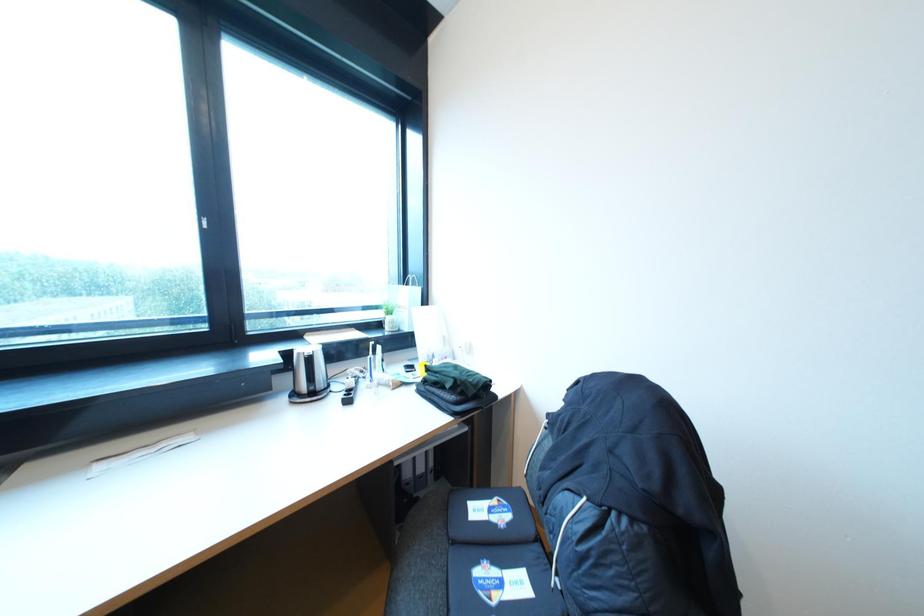
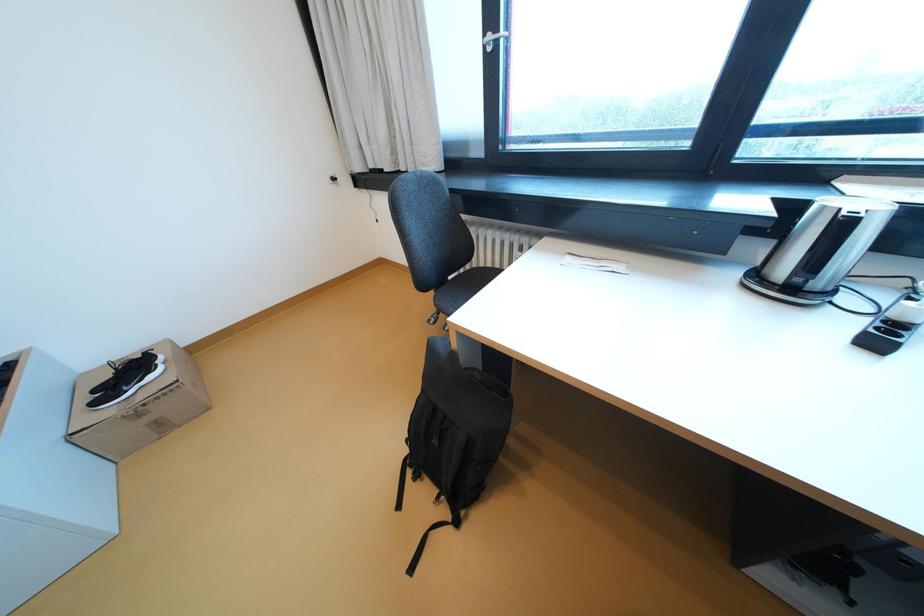
First-person continuous shooting, in which direction is the camera rotating?

The camera's rotation is toward left-down.